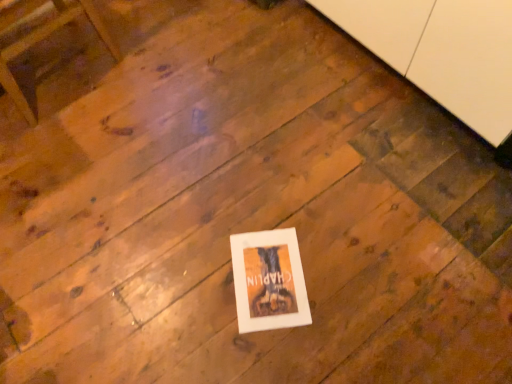
Question: From the image's perspective, is white paper at center located above or below wooden chair at upper left?

Choices:
 (A) below
 (B) above

Answer: (A)

Question: Considering the positions of point (269, 286) and point (2, 62), is point (269, 286) closer or farther from the camera than point (2, 62)?

Choices:
 (A) closer
 (B) farther

Answer: (A)

Question: Which object is the closest to the wooden chair at upper left?

Choices:
 (A) white matte cabinet at upper right
 (B) white paper at center

Answer: (B)

Question: Based on their relative distances, which object is nearer to the wooden chair at upper left?

Choices:
 (A) white matte cabinet at upper right
 (B) white paper at center

Answer: (B)